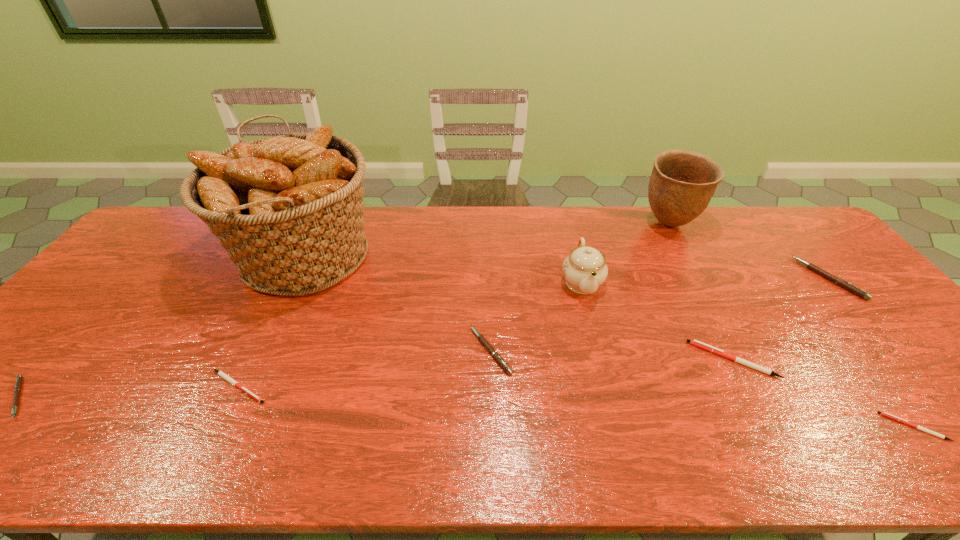
This screenshot has width=960, height=540. Find the location of `pink pen that is the second closest to the shortest object`. pink pen that is the second closest to the shortest object is located at coordinates (495, 354).

Choose which pink pen is the nearest neighbor to the chinaware. Please provide its 2D coordinates. Your answer should be formatted as a tuple, i.e. [(x, y)], where the tuple contains the x and y coordinates of a point satisfying the conditions above.

[(495, 354)]

Point out which white pen is positioned as the nearest to the smallest white pen. Please provide its 2D coordinates. Your answer should be formatted as a tuple, i.e. [(x, y)], where the tuple contains the x and y coordinates of a point satisfying the conditions above.

[(694, 342)]

Where is `the closest white pen to the leftmost pink pen`? Image resolution: width=960 pixels, height=540 pixels. the closest white pen to the leftmost pink pen is located at coordinates (220, 373).

You are a GUI agent. You are given a task and a screenshot of the screen. Output one action in this format:
    pyautogui.click(x=<x>, y=<y>)
    Task: Click on the free space that satisfies the following two spatial constraints: 1. at the spout of the chinaware; 2. on the clicker of the fifth pen from right to left
    
    Given the screenshot: What is the action you would take?
    pyautogui.click(x=608, y=387)

At what (x,y) coordinates should I click in order to perform the action: click on free point that satisfies the following two spatial constraints: 1. at the nib of the farthest pink pen; 2. at the spout of the seventh shortest object. Please return your answer as a coordinate pair (x, y). The image size is (960, 540). Looking at the image, I should click on (831, 282).